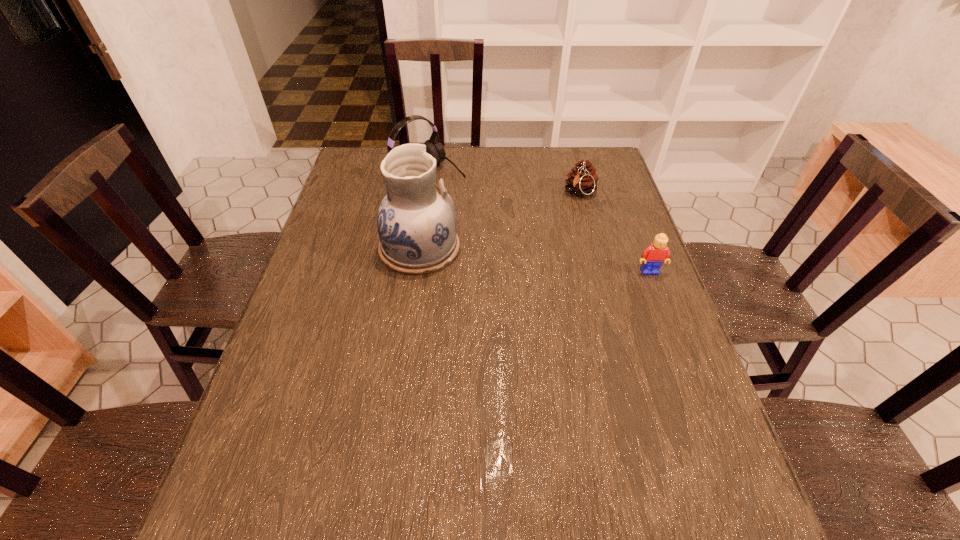
Where is `vacant space situated on the ear cushions of the headset`? vacant space situated on the ear cushions of the headset is located at coordinates (462, 193).

What are the coordinates of `vacant space located on the ear cushions of the headset` in the screenshot? It's located at (486, 211).

The width and height of the screenshot is (960, 540). What are the coordinates of `pinecone that is at the far edge` in the screenshot? It's located at (582, 180).

Identify the location of headset at the far edge. (433, 147).

The image size is (960, 540). I want to click on object positioned at the left edge, so click(x=433, y=147).

The height and width of the screenshot is (540, 960). I want to click on Lego present at the right edge, so click(x=653, y=257).

Where is `pinecone that is at the right edge`? This screenshot has height=540, width=960. pinecone that is at the right edge is located at coordinates (582, 180).

Locate an element on the screen. object that is positioned at the far left corner is located at coordinates pyautogui.click(x=433, y=147).

Find the location of `object that is at the far right corner`. object that is at the far right corner is located at coordinates (582, 180).

This screenshot has width=960, height=540. Identify the location of vacant space at the far edge of the desktop. (512, 163).